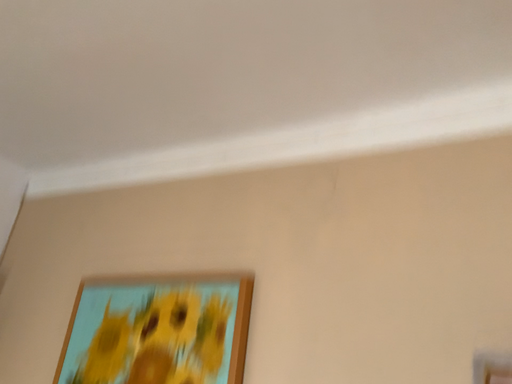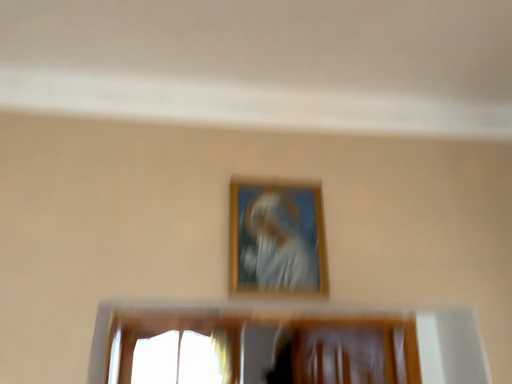
Question: Which way did the camera rotate in the video?

Choices:
 (A) rotated right
 (B) rotated left

Answer: (A)